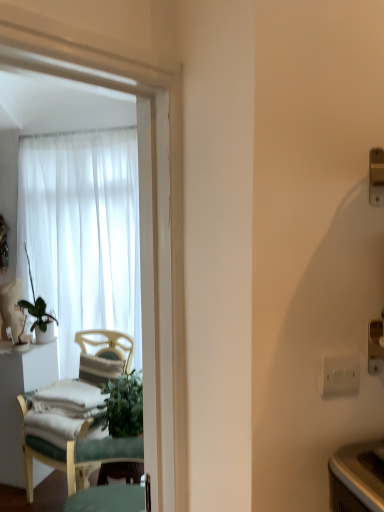
Question: From a real-world perspective, is white sheer curtain at upper left located beneath green fabric chair at left?

Choices:
 (A) yes
 (B) no

Answer: (B)

Question: Does white sheer curtain at upper left have a larger size compared to green fabric chair at left?

Choices:
 (A) yes
 (B) no

Answer: (B)

Question: Is white sheer curtain at upper left smaller than green fabric chair at left?

Choices:
 (A) no
 (B) yes

Answer: (B)

Question: Can you confirm if white sheer curtain at upper left is wider than green fabric chair at left?

Choices:
 (A) yes
 (B) no

Answer: (B)

Question: Considering the relative positions of white sheer curtain at upper left and green fabric chair at left in the image provided, is white sheer curtain at upper left to the right of green fabric chair at left from the viewer's perspective?

Choices:
 (A) yes
 (B) no

Answer: (B)

Question: From their relative heights in the image, would you say white fabric desk at left is taller or shorter than white plastic electric outlet at right?

Choices:
 (A) short
 (B) tall

Answer: (B)

Question: Is white fabric desk at left inside the boundaries of white plastic electric outlet at right, or outside?

Choices:
 (A) outside
 (B) inside

Answer: (A)

Question: Considering the positions of point (1, 449) and point (327, 372), is point (1, 449) closer or farther from the camera than point (327, 372)?

Choices:
 (A) farther
 (B) closer

Answer: (A)

Question: Is white fabric desk at left in front of or behind white plastic electric outlet at right in the image?

Choices:
 (A) front
 (B) behind

Answer: (B)

Question: Which is correct: white plastic electric outlet at right is inside green fabric chair at left, or outside of it?

Choices:
 (A) inside
 (B) outside

Answer: (B)

Question: From the image's perspective, is white plastic electric outlet at right located above or below green fabric chair at left?

Choices:
 (A) above
 (B) below

Answer: (A)

Question: Is point (339, 369) closer or farther from the camera than point (84, 476)?

Choices:
 (A) farther
 (B) closer

Answer: (B)

Question: Considering the positions of white plastic electric outlet at right and green fabric chair at left in the image, is white plastic electric outlet at right wider or thinner than green fabric chair at left?

Choices:
 (A) wide
 (B) thin

Answer: (B)

Question: In the image, is white plastic electric outlet at right positioned in front of or behind green leafy plant at left?

Choices:
 (A) front
 (B) behind

Answer: (A)

Question: Looking at their shapes, would you say white plastic electric outlet at right is wider or thinner than green leafy plant at left?

Choices:
 (A) wide
 (B) thin

Answer: (B)